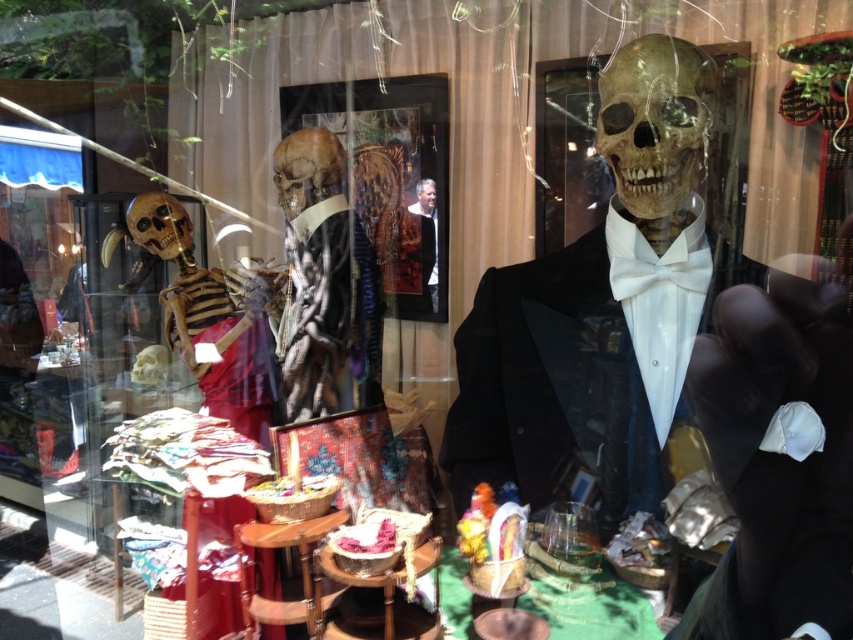
Question: Which point is closer to the camera taking this photo?

Choices:
 (A) (294, 163)
 (B) (646, 65)
 (C) (310, 147)
 (D) (434, 205)

Answer: (B)

Question: Does smooth beige skull at center have a greater width compared to smooth leather jacket at center?

Choices:
 (A) no
 (B) yes

Answer: (B)

Question: Which object is farther from the camera taking this photo?

Choices:
 (A) white satin bow tie at center
 (B) brown matte skull at center
 (C) matte black tuxedo at center
 (D) smooth leather jacket at center

Answer: (D)

Question: Can you confirm if matte black tuxedo at center is positioned to the left of smooth leather jacket at center?

Choices:
 (A) no
 (B) yes

Answer: (A)

Question: Among these objects, which one is farthest from the camera?

Choices:
 (A) smooth beige skull at center
 (B) matte black tuxedo at center
 (C) smooth leather jacket at center
 (D) white satin bow tie at center

Answer: (C)

Question: Where is matte black tuxedo at center located in relation to smooth leather jacket at center in the image?

Choices:
 (A) below
 (B) above

Answer: (A)